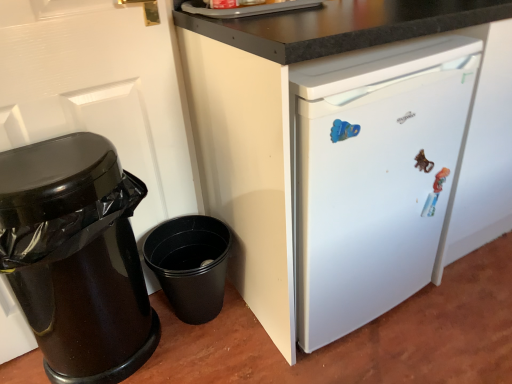
Locate an element on the screen. The image size is (512, 384). white glossy door at left is located at coordinates (102, 92).

You are a GUI agent. You are given a task and a screenshot of the screen. Output one action in this format:
    pyautogui.click(x=<x>, y=<y>)
    Task: Click on the white matte refrigerator at center
    The image size is (512, 384).
    Given the screenshot: What is the action you would take?
    pyautogui.click(x=351, y=152)

Is white glossy door at left further to camera compared to white matte refrigerator at center?

Yes, it is behind white matte refrigerator at center.

Between point (167, 193) and point (287, 29), which one is positioned behind?

The point (167, 193) is behind.

Considering the sizes of objects white glossy door at left and white matte refrigerator at center in the image provided, who is smaller, white glossy door at left or white matte refrigerator at center?

With smaller size is white glossy door at left.

Who is taller, white glossy door at left or white matte refrigerator at center?

Standing taller between the two is white glossy door at left.

What are the coordinates of `waste container behind the white matte refrigerator at center` in the screenshot? It's located at (76, 257).

In the scene shown: Is black glossy trash can at left positioned behind white matte refrigerator at center?

Yes, it is behind white matte refrigerator at center.

Based on the photo, considering the relative sizes of black glossy trash can at left and white matte refrigerator at center in the image provided, is black glossy trash can at left taller than white matte refrigerator at center?

No.

Is black glossy trash can at left far from white matte refrigerator at center?

No, there isn't a large distance between black glossy trash can at left and white matte refrigerator at center.

From the picture: Between white glossy door at left and black glossy trash can at left, which one has larger size?

Bigger between the two is black glossy trash can at left.

Does white glossy door at left have a greater width compared to black glossy trash can at left?

No, white glossy door at left is not wider than black glossy trash can at left.

Which object is more forward, white glossy door at left or black glossy trash can at left?

white glossy door at left is more forward.

Does black glossy trash can at left have a greater height compared to white glossy door at left?

No.

Which is farther from the camera, (99, 268) or (85, 35)?

Point (85, 35)

Does black glossy trash can at left turn towards white glossy door at left?

Yes, black glossy trash can at left is oriented towards white glossy door at left.

From a real-world perspective, is black glossy trash can at left physically above white glossy door at left?

No, from a real-world perspective, black glossy trash can at left is not over white glossy door at left

Identify the location of cabinetry in front of the black glossy trash can at left. Image resolution: width=512 pixels, height=384 pixels. (351, 152).

Can you confirm if white matte refrigerator at center is bigger than black glossy trash can at left?

Yes, white matte refrigerator at center is bigger than black glossy trash can at left.

Considering the points (496, 36) and (34, 275), which point is in front, point (496, 36) or point (34, 275)?

Positioned in front is point (34, 275).

From a real-world perspective, is white matte refrigerator at center positioned over white glossy door at left based on gravity?

No, from a real-world perspective, white matte refrigerator at center is not above white glossy door at left.

Does white matte refrigerator at center lie in front of white glossy door at left?

Yes, the depth of white matte refrigerator at center is less than that of white glossy door at left.

Is white matte refrigerator at center shorter than white glossy door at left?

Yes, white matte refrigerator at center is shorter than white glossy door at left.

How much distance is there between white matte refrigerator at center and white glossy door at left?

white matte refrigerator at center is 18.48 inches away from white glossy door at left.

Locate an element on the screen. cabinetry lying in front of the white glossy door at left is located at coordinates (351, 152).

The image size is (512, 384). What are the coordinates of `cabinetry above the black glossy trash can at left (from a real-world perspective)` in the screenshot? It's located at (351, 152).

Looking at this image, which object lies further to the anchor point white matte refrigerator at center, white glossy door at left or black glossy trash can at left?

black glossy trash can at left.

From the picture: Considering their positions, is black glossy trash can at left positioned closer to white matte refrigerator at center than white glossy door at left?

Based on the image, white glossy door at left appears to be nearer to white matte refrigerator at center.

Looking at this image, based on their spatial positions, is black glossy trash can at left or white matte refrigerator at center closer to white glossy door at left?

Among the two, black glossy trash can at left is located nearer to white glossy door at left.

From the image, which object appears to be nearer to white glossy door at left, white matte refrigerator at center or black glossy trash can at left?

black glossy trash can at left is closer to white glossy door at left.

Looking at the image, which one is located further to black glossy trash can at left, white glossy door at left or white matte refrigerator at center?

white matte refrigerator at center is positioned further to the anchor black glossy trash can at left.

Looking at the image, which one is located closer to black glossy trash can at left, white matte refrigerator at center or white glossy door at left?

The object closer to black glossy trash can at left is white glossy door at left.

The image size is (512, 384). I want to click on waste container between white glossy door at left and white matte refrigerator at center in the horizontal direction, so click(76, 257).